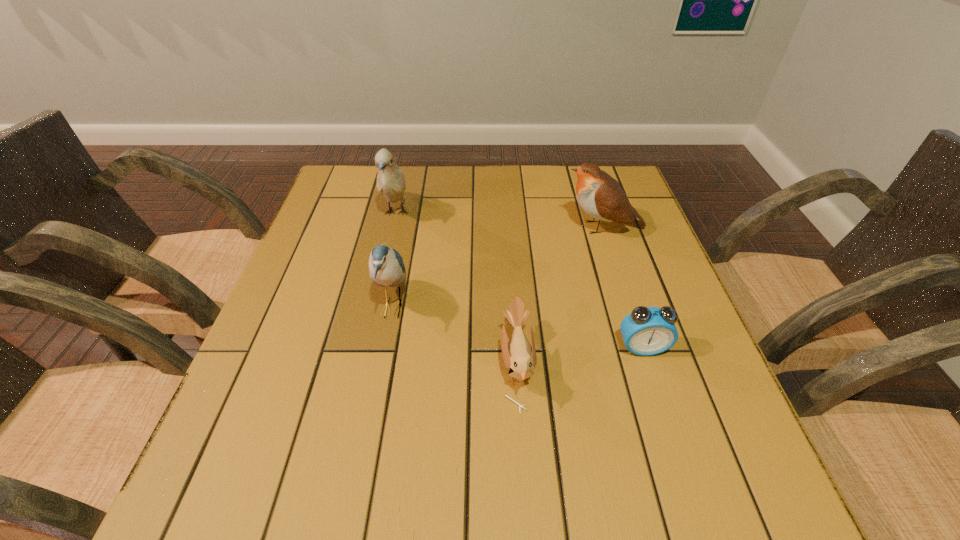
Identify the location of the rightmost bird. This screenshot has height=540, width=960. (602, 197).

I want to click on alarm clock, so click(646, 331).

Identify the location of the shortest bird. (519, 356).

You are a GUI agent. You are given a task and a screenshot of the screen. Output one action in this format:
    pyautogui.click(x=<x>, y=<y>)
    Task: Click on the third object from right to left
    
    Given the screenshot: What is the action you would take?
    pyautogui.click(x=519, y=356)

This screenshot has width=960, height=540. I want to click on free space located 0.090m at the face of the rightmost bird, so coord(528,227).

What are the coordinates of `vacant space situated 0.360m at the face of the rightmost bird` in the screenshot? It's located at (426, 227).

Locate an element on the screen. vacant area situated 0.200m at the face of the rightmost bird is located at coordinates 486,227.

The width and height of the screenshot is (960, 540). Identify the location of vacant position located on the face of the alarm clock. click(657, 393).

This screenshot has width=960, height=540. In order to click on vacant space located 0.120m at the beak of the shortest bird in this screenshot , I will do `click(439, 364)`.

Identify the location of blank space located 0.390m at the beak of the shortest bird. The width and height of the screenshot is (960, 540). (300, 364).